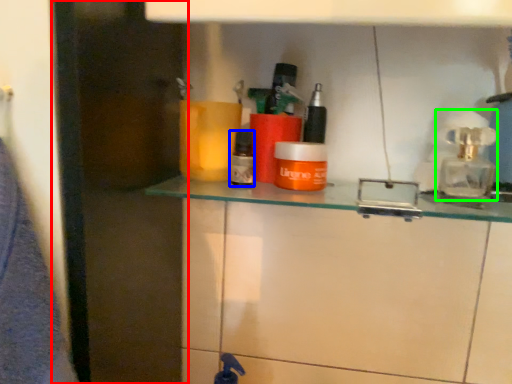
Question: Which object is positioned farthest from glass door (highlighted by a red box)? Select from toiletry (highlighted by a blue box) and soap dispenser (highlighted by a green box).

Choices:
 (A) toiletry
 (B) soap dispenser

Answer: (B)